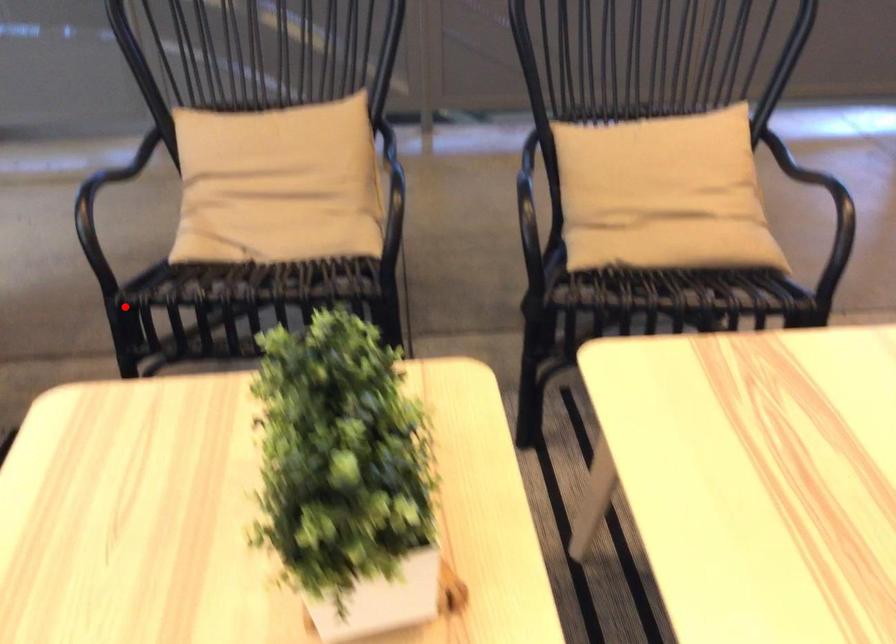
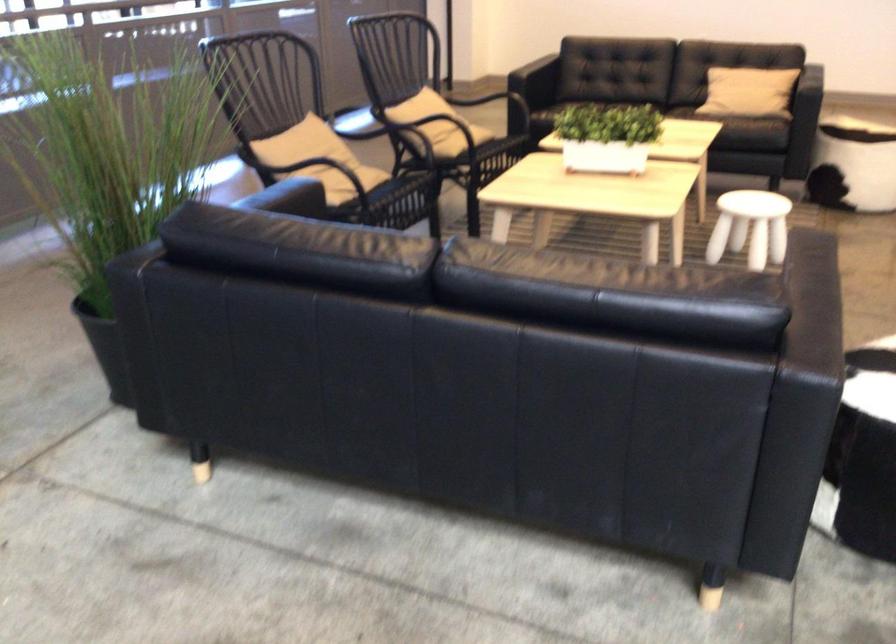
Question: I am providing you with two images of the same scene from different viewpoints. Image1 has a red point marked. In image2, the corresponding 3D location appears at what relative position? Reply with the corresponding letter.

Choices:
 (A) Closer
 (B) Farther

Answer: (B)